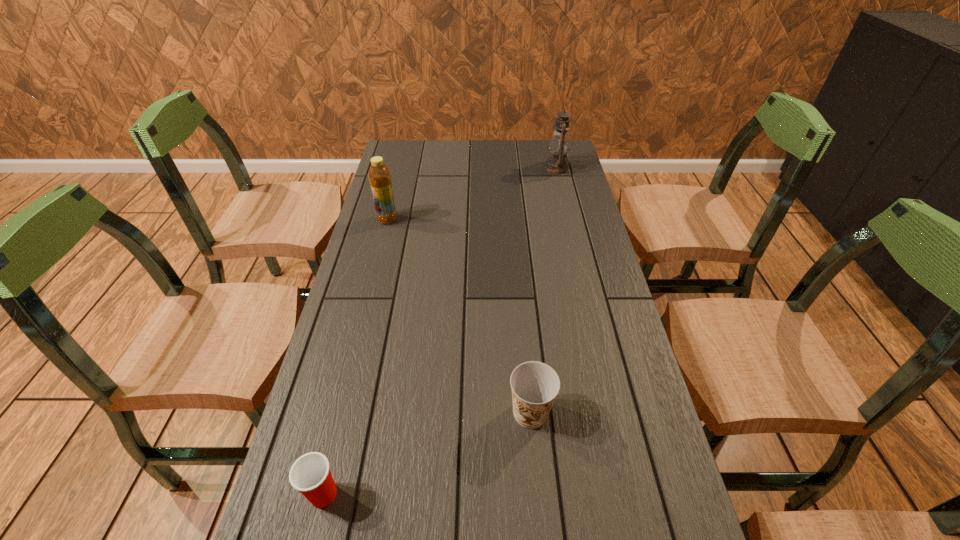
Find the location of a particular element. oil lamp is located at coordinates (559, 145).

Identify the location of the tallest object. The height and width of the screenshot is (540, 960). (559, 145).

Where is `the third shortest object`? The image size is (960, 540). the third shortest object is located at coordinates (379, 175).

This screenshot has width=960, height=540. I want to click on bottle, so click(x=379, y=175).

Where is `the second nearest object`? the second nearest object is located at coordinates (535, 385).

Find the location of a particular element. This screenshot has width=960, height=540. the third object from left to right is located at coordinates (535, 385).

Find the location of a particular element. This screenshot has width=960, height=540. the nearer Dixie cup is located at coordinates (310, 474).

You are a GUI agent. You are given a task and a screenshot of the screen. Output one action in this format:
    pyautogui.click(x=<x>, y=<y>)
    Task: Click on the nearest object
    
    Given the screenshot: What is the action you would take?
    pyautogui.click(x=310, y=474)

Image resolution: width=960 pixels, height=540 pixels. I want to click on vacant region located on the front of the farthest object, so [570, 224].

Image resolution: width=960 pixels, height=540 pixels. Find the location of `free space located on the back of the second tallest object`. free space located on the back of the second tallest object is located at coordinates (395, 191).